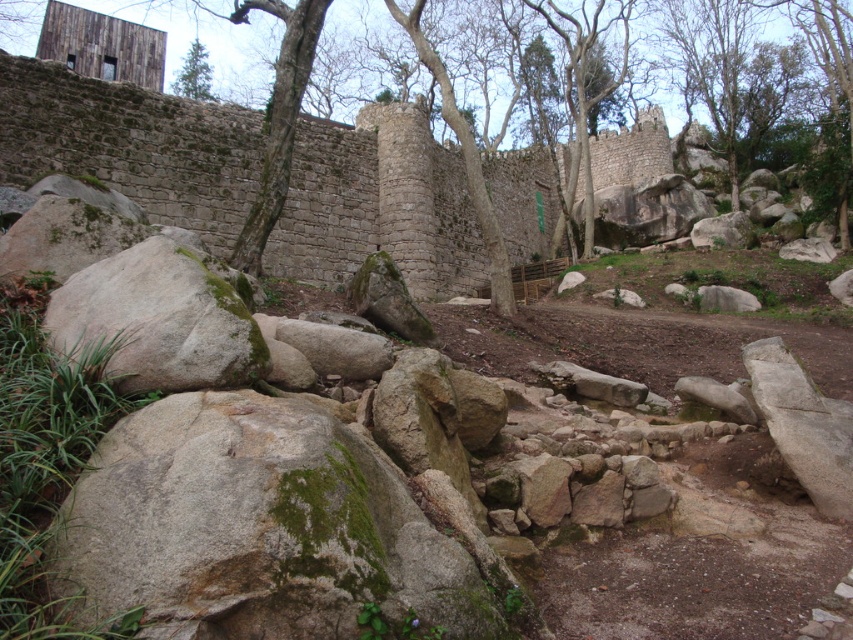
Question: Is green mossy rock at lower left closer to the viewer compared to green matte tree at upper left?

Choices:
 (A) yes
 (B) no

Answer: (A)

Question: Is green mossy rock at lower left positioned at the back of green matte tree at upper left?

Choices:
 (A) yes
 (B) no

Answer: (B)

Question: Which point is closer to the camera?

Choices:
 (A) green mossy rock at lower left
 (B) green matte tree at upper left

Answer: (A)

Question: Where is green mossy rock at lower left located in relation to green matte tree at upper left in the image?

Choices:
 (A) left
 (B) right

Answer: (B)